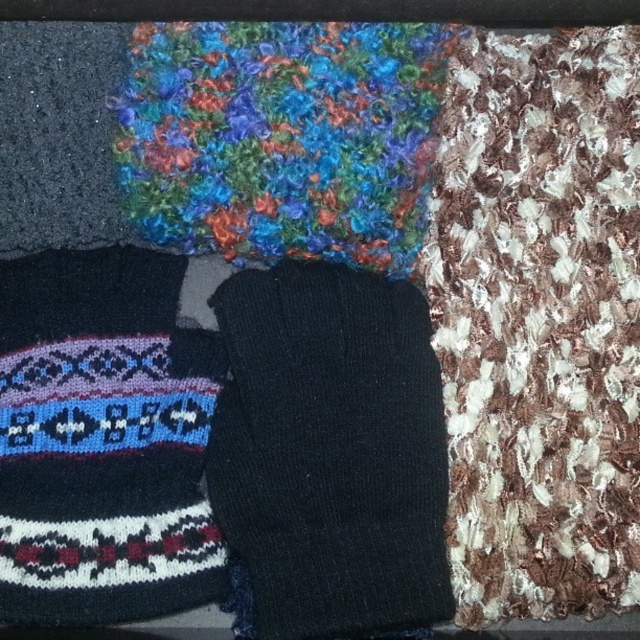
You are trying to decide which sock to wear today. You have a black knitted sock at center and a knitted woolen sock at lower left. Which sock is taller?

The black knitted sock at center is much taller than the knitted woolen sock at lower left.

You are organizing a sock drawer and see the black knitted sock at center and the knitted woolen sock at lower left. Which sock is placed below the other?

The black knitted sock at center is positioned under the knitted woolen sock at lower left, so it is placed below the other.